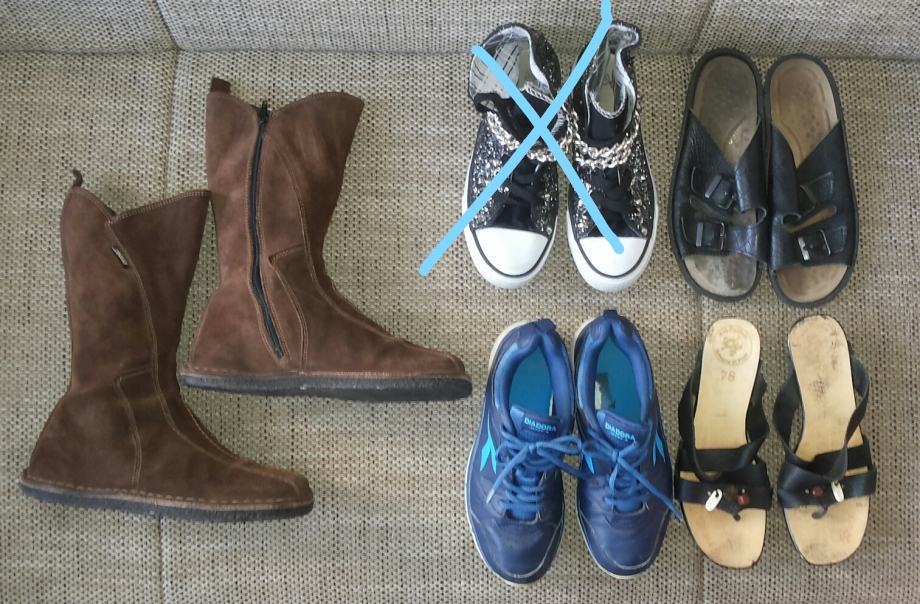
At what (x,y) coordinates should I click in order to perform the action: click on pairs of shoes. Please return your answer as a coordinate pair (x, y). Looking at the image, I should click on (176, 362), (567, 162), (776, 162), (570, 426), (769, 437).